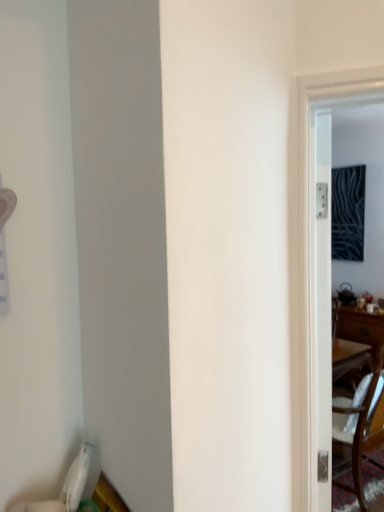
The image size is (384, 512). Find the location of `wooden chair at right`. wooden chair at right is located at coordinates (357, 413).

What do you see at coordinates (357, 413) in the screenshot?
I see `wooden chair at right` at bounding box center [357, 413].

This screenshot has height=512, width=384. In order to click on wooden chair at right in this screenshot , I will do `click(357, 413)`.